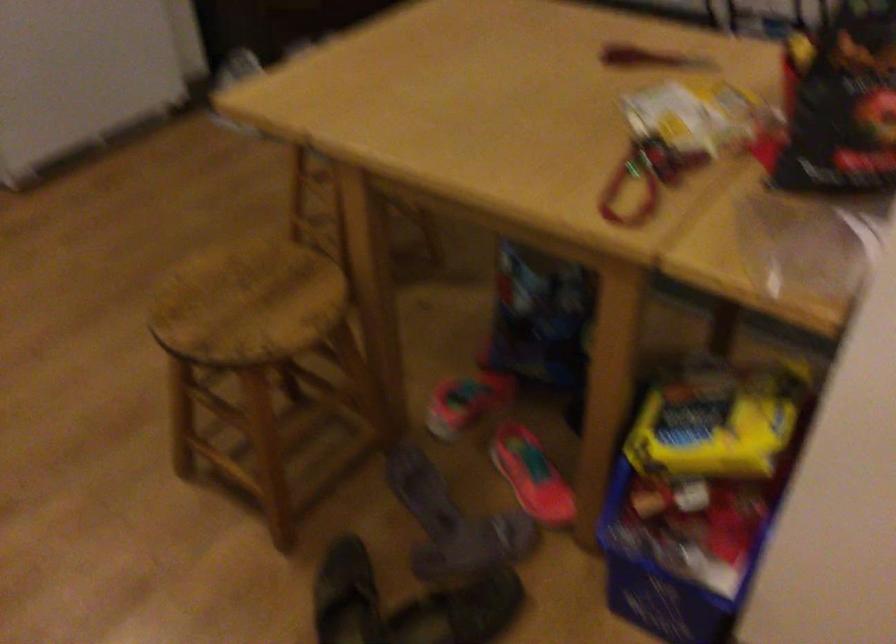
You are a GUI agent. You are given a task and a screenshot of the screen. Output one action in this format:
    pyautogui.click(x=<x>, y=<y>)
    Task: Click on the chair sitting surface
    This screenshot has width=896, height=644.
    Given the screenshot: What is the action you would take?
    pyautogui.click(x=247, y=304)